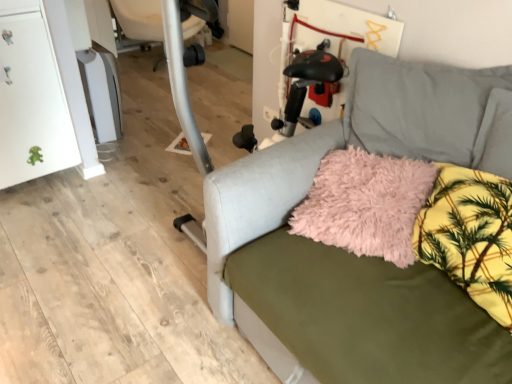
Question: From the image's perspective, is matte gray couch at center over fluffy pink pillow at center?

Choices:
 (A) no
 (B) yes

Answer: (A)

Question: Does matte gray couch at center have a lesser width compared to fluffy pink pillow at center?

Choices:
 (A) no
 (B) yes

Answer: (A)

Question: From the image's perspective, does matte gray couch at center appear lower than fluffy pink pillow at center?

Choices:
 (A) yes
 (B) no

Answer: (A)

Question: Considering the relative sizes of matte gray couch at center and fluffy pink pillow at center in the image provided, is matte gray couch at center shorter than fluffy pink pillow at center?

Choices:
 (A) no
 (B) yes

Answer: (A)

Question: From a real-world perspective, does matte gray couch at center stand above fluffy pink pillow at center?

Choices:
 (A) no
 (B) yes

Answer: (A)

Question: Do you think matte gray couch at center is within yellow floral fabric pillow at lower right, or outside of it?

Choices:
 (A) inside
 (B) outside

Answer: (B)

Question: Is point (436, 370) closer or farther from the camera than point (471, 216)?

Choices:
 (A) closer
 (B) farther

Answer: (A)

Question: Relative to yellow floral fabric pillow at lower right, is matte gray couch at center in front or behind?

Choices:
 (A) front
 (B) behind

Answer: (A)

Question: Is matte gray couch at center bigger or smaller than yellow floral fabric pillow at lower right?

Choices:
 (A) small
 (B) big

Answer: (B)

Question: Is yellow floral fabric pillow at lower right in front of or behind white plastic swivel chair at upper left in the image?

Choices:
 (A) behind
 (B) front

Answer: (B)

Question: From a real-world perspective, is yellow floral fabric pillow at lower right above or below white plastic swivel chair at upper left?

Choices:
 (A) above
 (B) below

Answer: (A)

Question: In terms of height, does yellow floral fabric pillow at lower right look taller or shorter compared to white plastic swivel chair at upper left?

Choices:
 (A) short
 (B) tall

Answer: (A)

Question: Is yellow floral fabric pillow at lower right inside the boundaries of white plastic swivel chair at upper left, or outside?

Choices:
 (A) outside
 (B) inside

Answer: (A)

Question: Relative to yellow floral fabric pillow at lower right, is white plastic swivel chair at upper left in front or behind?

Choices:
 (A) front
 (B) behind

Answer: (B)

Question: From a real-world perspective, is white plastic swivel chair at upper left positioned above or below yellow floral fabric pillow at lower right?

Choices:
 (A) below
 (B) above

Answer: (A)